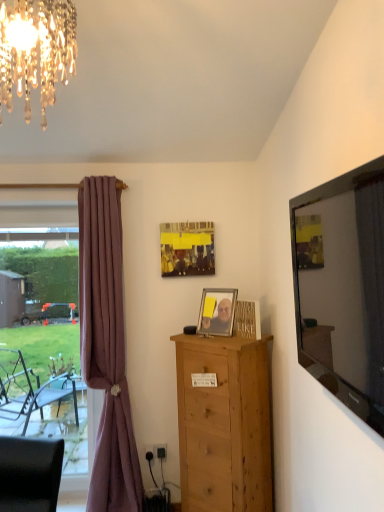
Locate an element on the screen. empty space that is ontop of natural wood chest of drawers at center is located at coordinates (208, 336).